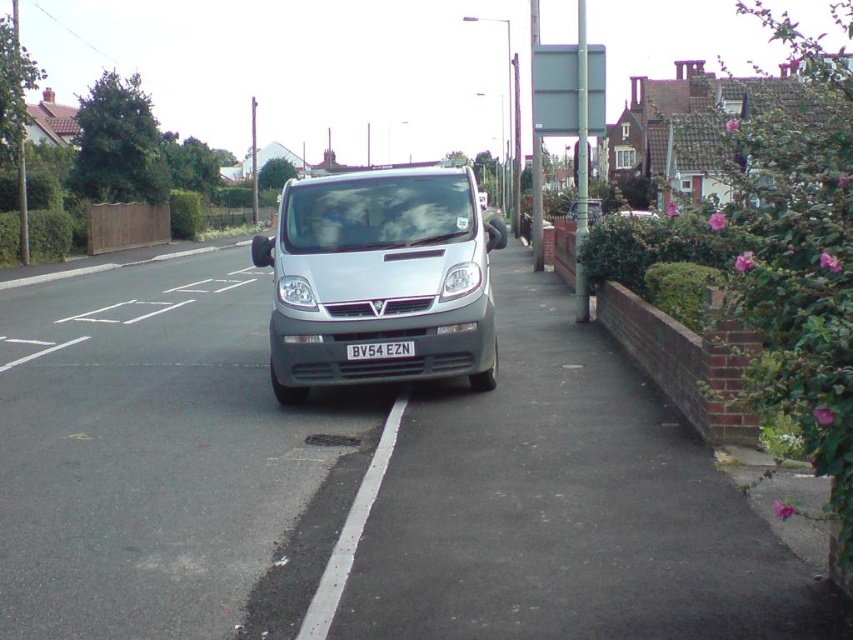
Where is `silver metallic van at center`? Image resolution: width=853 pixels, height=640 pixels. silver metallic van at center is located at coordinates (380, 278).

Where is `silver metallic van at center`? The image size is (853, 640). silver metallic van at center is located at coordinates (380, 278).